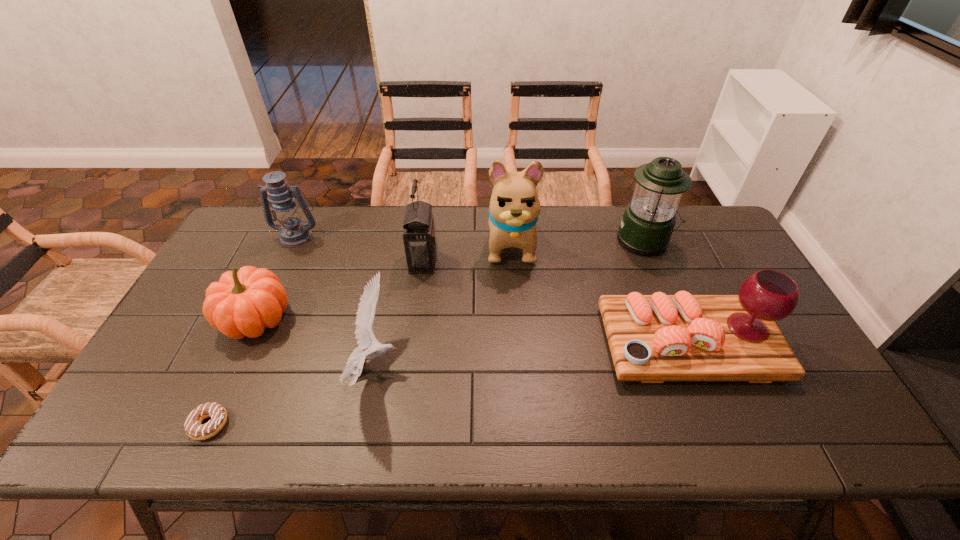
The width and height of the screenshot is (960, 540). What are the coordinates of `puppy` in the screenshot? It's located at (514, 208).

The width and height of the screenshot is (960, 540). What are the coordinates of `the rightmost lantern` in the screenshot? It's located at (649, 219).

The height and width of the screenshot is (540, 960). I want to click on the second lantern from left to right, so click(419, 235).

This screenshot has width=960, height=540. In order to click on the leftmost lantern in this screenshot , I will do `click(293, 232)`.

Find the location of a particular element. platter is located at coordinates (654, 338).

Find the location of a particular element. pumpkin is located at coordinates (243, 303).

The width and height of the screenshot is (960, 540). What are the coordinates of `gull` in the screenshot? It's located at (365, 337).

The image size is (960, 540). I want to click on the shortest object, so click(x=192, y=425).

You are a GUI agent. You are given a task and a screenshot of the screen. Output one action in this format:
    pyautogui.click(x=<x>, y=<y>)
    Task: Click on the free spot located 0.190m on the face of the puppy
    This screenshot has width=960, height=540.
    Given the screenshot: What is the action you would take?
    pyautogui.click(x=516, y=321)

At what (x,y) coordinates should I click in order to perform the action: click on vacant space located on the left of the rightmost lantern. Please return your answer as a coordinate pair (x, y). The height and width of the screenshot is (540, 960). Looking at the image, I should click on (571, 241).